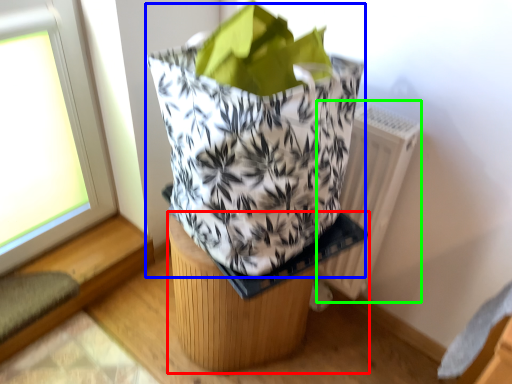
Question: Which is nearer to the furniture (highlighted by a red box)? grocery bag (highlighted by a blue box) or radiator (highlighted by a green box).

Choices:
 (A) grocery bag
 (B) radiator

Answer: (A)